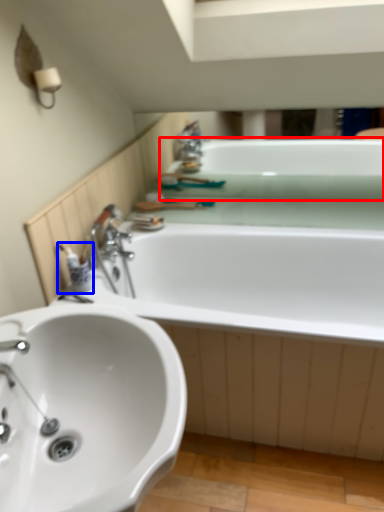
Question: Which of the following is the closest to the observer, bath (highlighted by a red box) or toiletry (highlighted by a blue box)?

Choices:
 (A) bath
 (B) toiletry

Answer: (B)